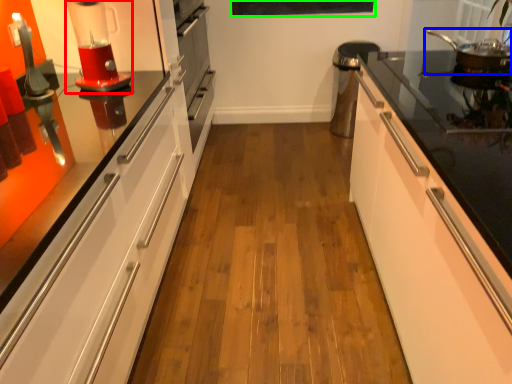
Question: Which object is the closest to the home appliance (highlighted by a red box)? Choose among these: kitchen appliance (highlighted by a blue box) or bulletin board (highlighted by a green box).

Choices:
 (A) kitchen appliance
 (B) bulletin board

Answer: (A)